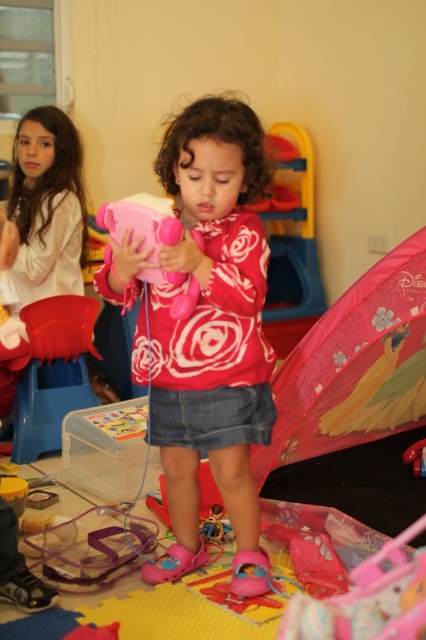
You are standing in the playroom and want to pick up an object. You notice two points marked in the scene. Which point, point (x=192, y=156) or point (x=193, y=230), is closer to you?

Point (x=192, y=156) is closer to the viewer than point (x=193, y=230).

You are a toy collector who wants to take a clear photo of the pink matte toy phone at center and the rubberized pink sandals at lower center. Since you can only focus on one object at a time, which object should you focus on to ensure the other remains in the background?

You should focus on the pink matte toy phone at center because it is closer to the viewer than the rubberized pink sandals at lower center, so if you focus on it, the sandals will be in the background.

You are a parent trying to put away toys. You see the rubberized pink sandals at lower center and the matte pink toy at center. Which item is wider?

The rubberized pink sandals at lower center might be wider than matte pink toy at center.